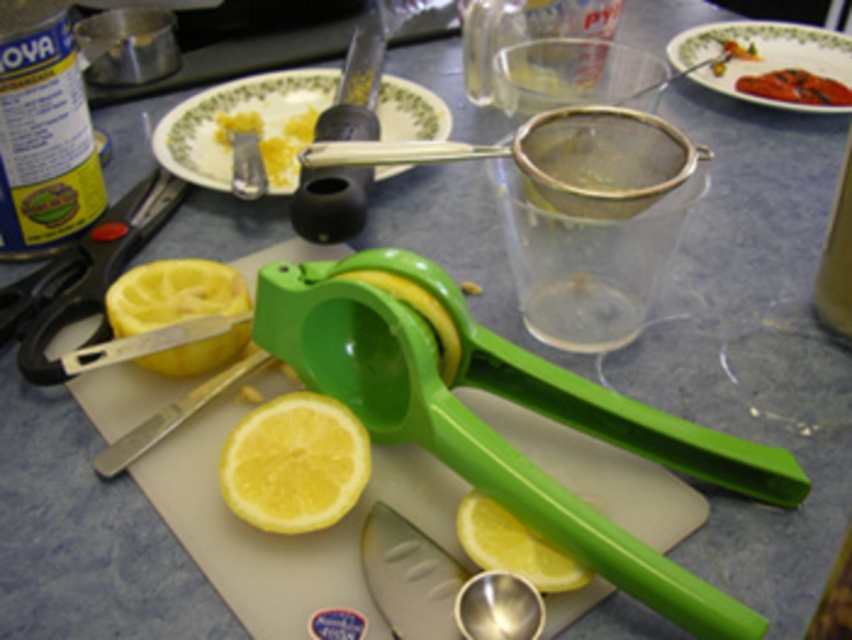
Question: Which point is farther to the camera?

Choices:
 (A) (819, 81)
 (B) (338, 456)

Answer: (A)

Question: Where is yellow matte lemon at center located in relation to yellow matte lemon at center-left in the image?

Choices:
 (A) left
 (B) right

Answer: (B)

Question: Which point is farther from the camera taking this photo?

Choices:
 (A) (352, 276)
 (B) (479, 560)
 (C) (137, 316)

Answer: (C)

Question: Among these points, which one is farthest from the camera?

Choices:
 (A) (476, 536)
 (B) (190, 284)
 (C) (818, 76)
 (D) (279, 406)

Answer: (C)

Question: Is yellow matte lemon at center thinner than grilled meat at upper right?

Choices:
 (A) yes
 (B) no

Answer: (A)

Question: Does yellow matte lemon at center have a lesser width compared to green matte juicer at center?

Choices:
 (A) no
 (B) yes

Answer: (A)